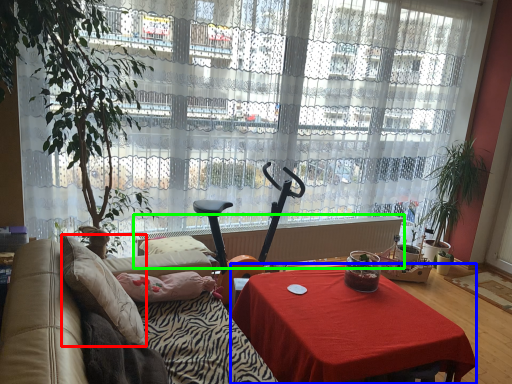
Question: Which is nearer to the pillow (highlighted by a red box)? desk (highlighted by a blue box) or radiator (highlighted by a green box).

Choices:
 (A) desk
 (B) radiator

Answer: (A)